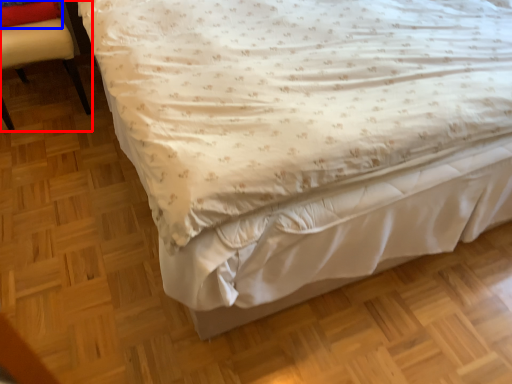
Question: Which point is closer to the camera, chair (highlighted by a red box) or pillow (highlighted by a blue box)?

Choices:
 (A) chair
 (B) pillow

Answer: (A)